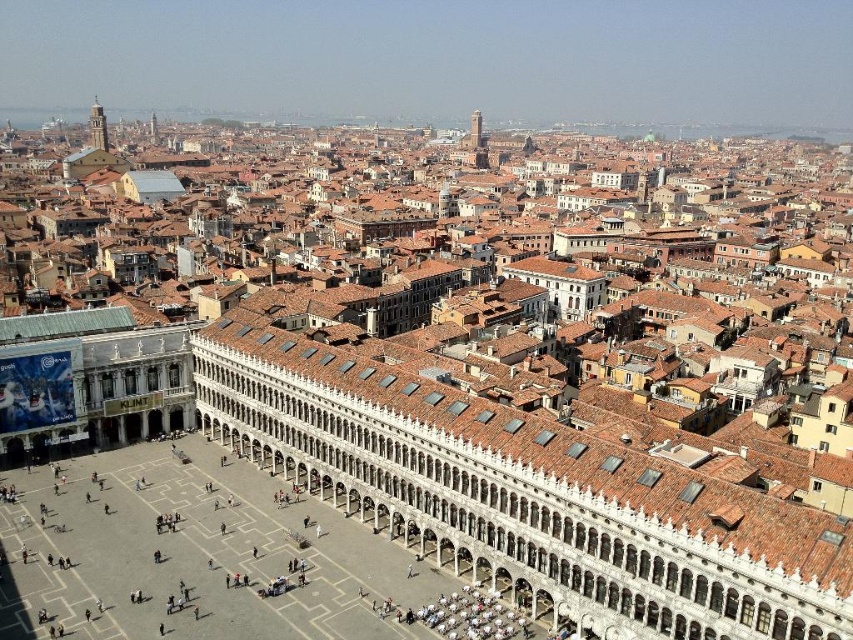
You are standing in St. Mark Square in Venice and want to take a photo of the smooth white tower at upper left. If your camera can focus on objects up to 500 meters away, will you be able to capture it clearly?

The smooth white tower at upper left is 491.52 meters away from you. Since your camera can focus up to 500 meters, you can capture it clearly.

You are standing at the Doge Palace and want to walk to the point marked as point [469,122]. There is an obstacle at point [96,99]. Will you have to go around it?

Yes, you will have to go around the obstacle at point [96,99] because it is in front of your path to point [469,122].

You are a tourist standing in the middle of St. Mark Square and want to take a photo of both the smooth white tower at upper left and the smooth stone tower at upper center. Since you have a camera with a fixed focal length, you need to know which tower is wider to ensure both fit in the frame. Which tower has a greater width?

The smooth white tower at upper left has a greater width than the smooth stone tower at upper center.